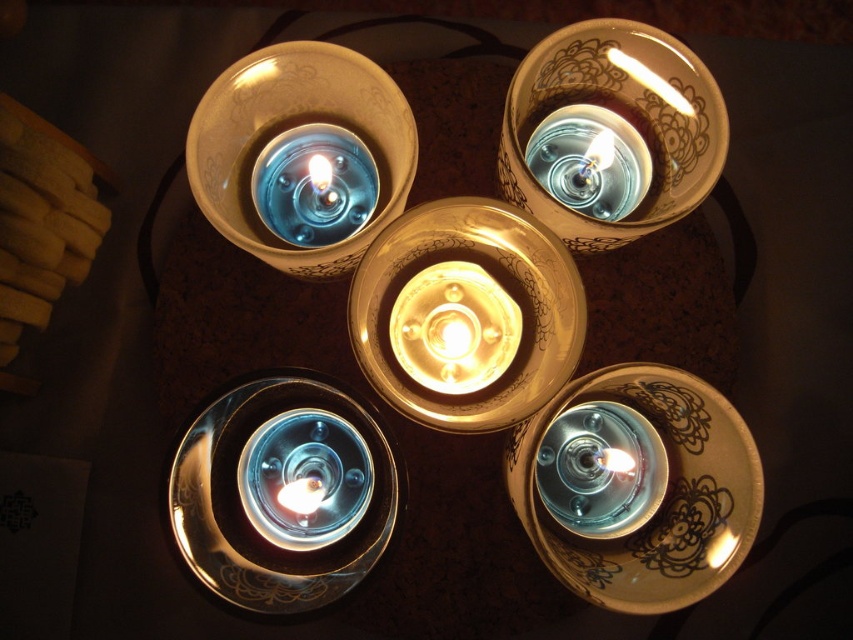
Question: Considering the real-world distances, which object is closest to the matte gold candle at upper center?

Choices:
 (A) matte gold candle holder at center
 (B) translucent glass candle at upper center
 (C) matte glass candle at lower left

Answer: (B)

Question: Which of the following is the farthest from the observer?

Choices:
 (A) matte gold candle at upper center
 (B) metallic gold candle holder at bottom left

Answer: (A)

Question: Is matte gold candle holder at lower right above matte gold candle at upper center?

Choices:
 (A) yes
 (B) no

Answer: (B)

Question: Estimate the real-world distances between objects in this image. Which object is closer to the matte gold candle at lower right?

Choices:
 (A) matte gold candle at center
 (B) porcelain candle at upper right
 (C) blue glass candle at upper left
 (D) matte gold candle holder at lower right

Answer: (D)

Question: In this image, where is matte gold candle at upper center located relative to matte silver candle at lower right?

Choices:
 (A) right
 (B) left

Answer: (A)

Question: Is matte gold candle holder at lower right wider than matte glass candle at lower left?

Choices:
 (A) yes
 (B) no

Answer: (A)